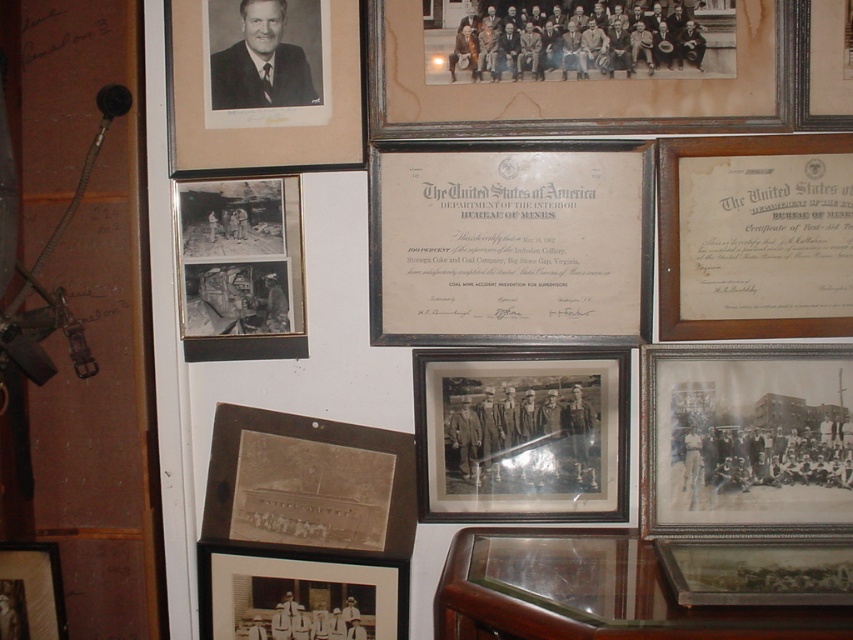
Question: Which point is closer to the camera?

Choices:
 (A) black and white photograph of group at upper center
 (B) metallic silver photo frame at lower right

Answer: (B)

Question: Estimate the real-world distances between objects in this image. Which object is farther from the black and white photograph of group at upper center?

Choices:
 (A) black matte photograph at upper left
 (B) brown wooden photo frame at center
 (C) wooden certificate at upper right

Answer: (B)

Question: Considering the relative positions of black and white photograph of group at upper center and matte black photo frame at lower left in the image provided, where is black and white photograph of group at upper center located with respect to matte black photo frame at lower left?

Choices:
 (A) left
 (B) right

Answer: (B)

Question: Which point appears farthest from the camera in this image?

Choices:
 (A) (746, 140)
 (B) (476, 369)

Answer: (B)

Question: Does black matte photograph at upper left appear on the right side of silver metallic picture frame at upper right?

Choices:
 (A) no
 (B) yes

Answer: (A)

Question: Is brown wooden photo frame at center below matte brown photo frame at lower left?

Choices:
 (A) yes
 (B) no

Answer: (B)